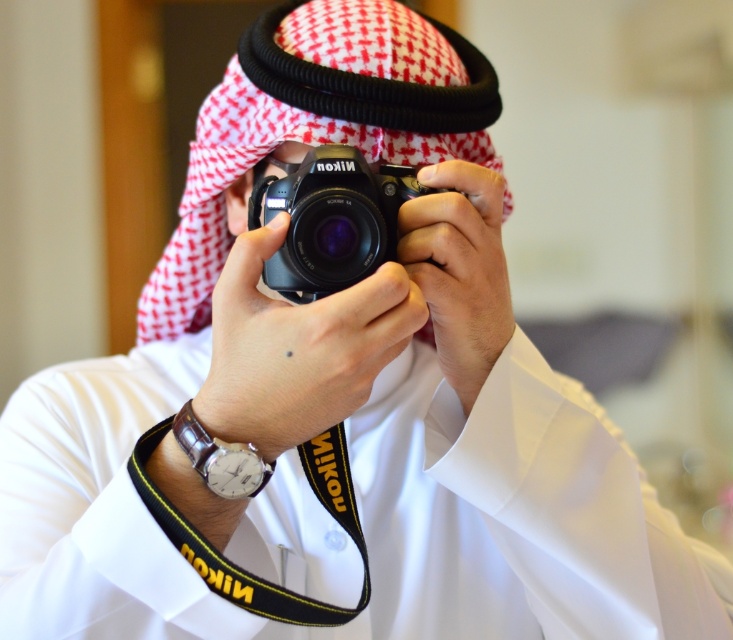
You are a photographer trying to decide where to place your black matte nikon camera at center and leather watch at lower left on a shelf. If you want to arrange them side by side, which object should be placed on the left to ensure they don not overlap?

The leather watch at lower left should be placed on the left because it is shorter than the black matte nikon camera at center, so they won not overlap when arranged side by side.

You are standing in front of the person taking a photo. You notice two points marked on their clothing. The first point is located at coordinates point (358,218) and the second at point (218,490). From your perspective, which point is closer to you?

Point (218,490) is closer to you because it is in front of point (358,218).

You are a photographer trying to decide which accessory to use first. The black matte nikon camera at center and the leather watch at lower left are both in your view. Which one do you need to reach for first if you want to take a photo?

The black matte nikon camera at center is bigger than the leather watch at lower left, so you need to reach for the black matte nikon camera at center first to take a photo.